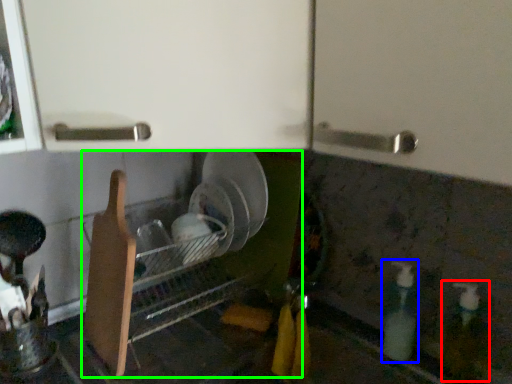
Question: Based on their relative distances, which object is nearer to bottle (highlighted by a red box)? Choose from bottle (highlighted by a blue box) and dish washer (highlighted by a green box).

Choices:
 (A) bottle
 (B) dish washer

Answer: (A)